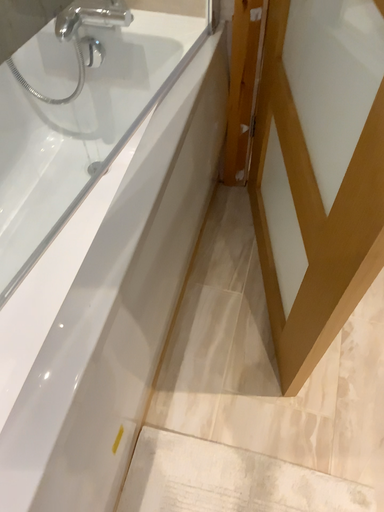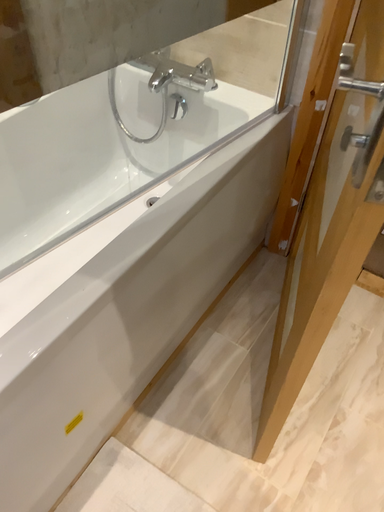
Question: Which way did the camera rotate in the video?

Choices:
 (A) rotated downward
 (B) rotated upward

Answer: (B)